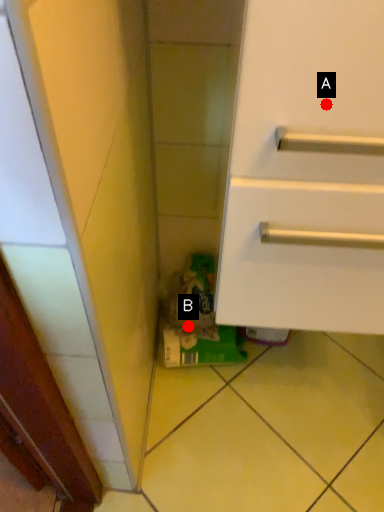
Question: Two points are circled on the image, labeled by A and B beside each circle. Which point is farther to the camera?

Choices:
 (A) A is further
 (B) B is further

Answer: (B)